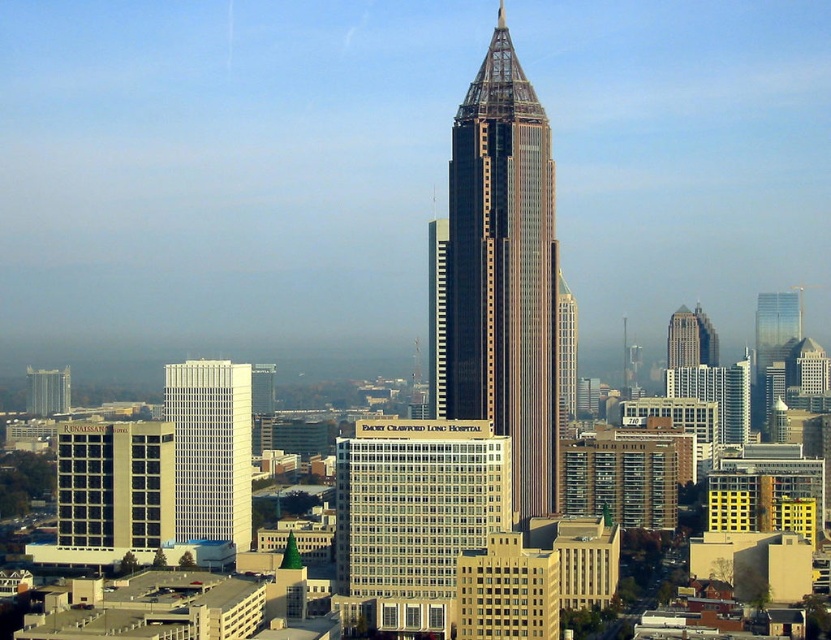
Who is taller, shiny glass skyscraper at center or white glass building at center?

With more height is shiny glass skyscraper at center.

Identify the location of shiny glass skyscraper at center. This screenshot has width=831, height=640. (504, 272).

Is shiny glass skyscraper at center shorter than matte glass skyscraper at left?

No.

Is shiny glass skyscraper at center taller than matte glass skyscraper at left?

Indeed, shiny glass skyscraper at center has a greater height compared to matte glass skyscraper at left.

Does point (548, 408) come behind point (55, 406)?

No, it is in front of (55, 406).

Image resolution: width=831 pixels, height=640 pixels. In order to click on shiny glass skyscraper at center in this screenshot , I will do `click(504, 272)`.

Does shiny glass skyscraper at center have a greater width compared to white glass building at center-left?

Correct, the width of shiny glass skyscraper at center exceeds that of white glass building at center-left.

Consider the image. Does shiny glass skyscraper at center come in front of white glass building at center-left?

That is True.

I want to click on shiny glass skyscraper at center, so click(x=504, y=272).